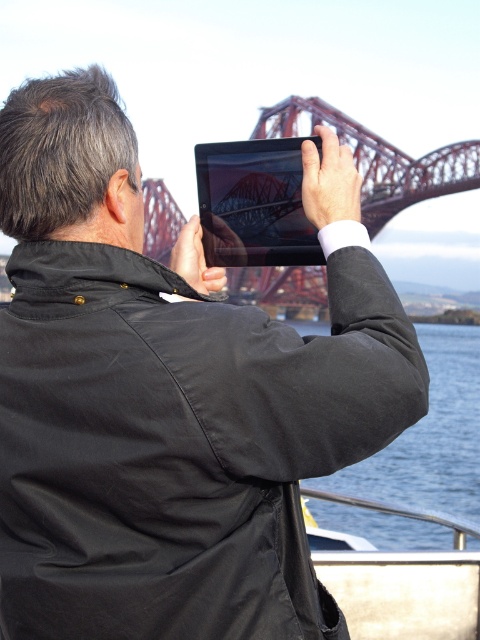
You are standing on the metallic silver boat at lower right and want to take a photo of the large red bridge. Since the blue water at lower right is taller than the boat, will you need to adjust your position to get a better view of the bridge?

The blue water at lower right is taller than the metallic silver boat at lower right, so you may need to adjust your position to avoid the water obstructing your view of the bridge.

You are a photographer planning to capture a wide shot of the blue water at lower right and the metallic silver boat at lower right. Based on their positions, do you think you can include both in a single frame without moving your camera position?

The blue water at lower right might be wider than metallic silver boat at lower right, so it is possible to include both in a single frame if the camera angle allows capturing the width of the water and the boat simultaneously.